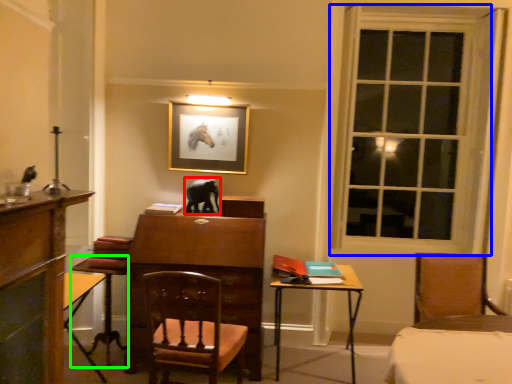
Question: Based on their relative distances, which object is farther from animal (highlighted by a red box)? Choose from window (highlighted by a blue box) and table (highlighted by a green box).

Choices:
 (A) window
 (B) table

Answer: (A)